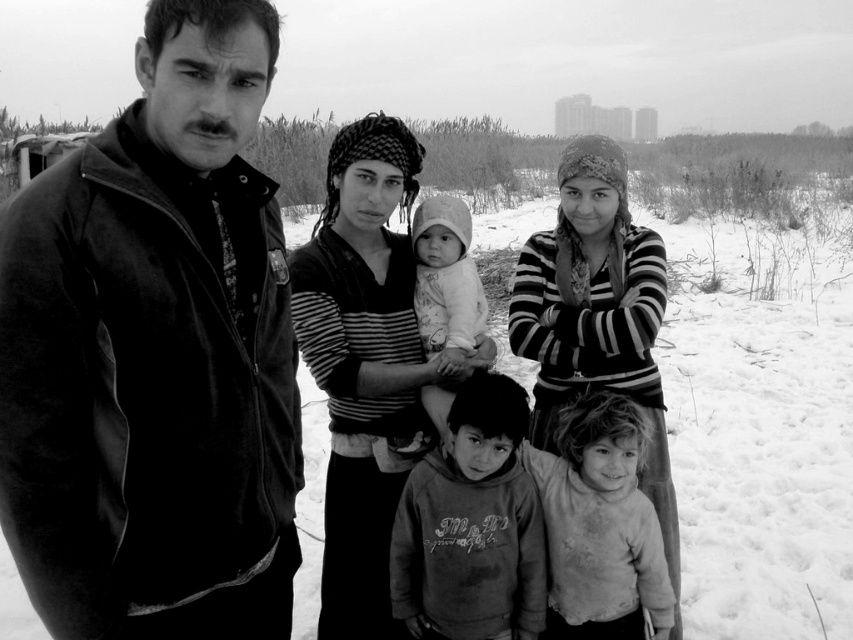
Question: Among these objects, which one is farthest from the camera?

Choices:
 (A) dirty gray sweatshirt at center
 (B) dirty white shirt at lower center

Answer: (B)

Question: Does velvet black jacket at left appear over striped knit sweater at center?

Choices:
 (A) yes
 (B) no

Answer: (A)

Question: Does velvet black jacket at left appear over dirty white shirt at lower center?

Choices:
 (A) yes
 (B) no

Answer: (A)

Question: Which object appears closest to the camera in this image?

Choices:
 (A) striped knit sweater at center
 (B) dirty white shirt at lower center
 (C) white soft baby at center
 (D) velvet black jacket at left

Answer: (D)

Question: Does striped fabric adult at center appear on the right side of white soft baby at center?

Choices:
 (A) no
 (B) yes

Answer: (A)

Question: Which object is farther from the camera taking this photo?

Choices:
 (A) dirty white shirt at lower center
 (B) dirty gray sweatshirt at center

Answer: (A)